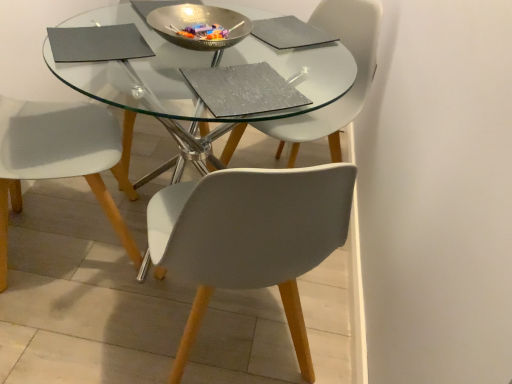
Question: Is metallic silver bowl at center positioned far away from white matte chair at lower left, placed as the first chair when sorted from left to right?

Choices:
 (A) no
 (B) yes

Answer: (A)

Question: Is metallic silver bowl at center to the right of white matte chair at lower left, which is the second chair in right-to-left order, from the viewer's perspective?

Choices:
 (A) no
 (B) yes

Answer: (B)

Question: From a real-world perspective, is metallic silver bowl at center physically below white matte chair at lower left, which is the second chair in right-to-left order?

Choices:
 (A) yes
 (B) no

Answer: (B)

Question: Can you confirm if metallic silver bowl at center is smaller than white matte chair at lower left, which is the second chair in right-to-left order?

Choices:
 (A) no
 (B) yes

Answer: (B)

Question: Is metallic silver bowl at center positioned with its back to white matte chair at lower left, placed as the first chair when sorted from left to right?

Choices:
 (A) no
 (B) yes

Answer: (A)

Question: From the image's perspective, is matte gray chair at center, acting as the second chair starting from the left, above or below white matte chair at lower left, placed as the first chair when sorted from left to right?

Choices:
 (A) above
 (B) below

Answer: (A)

Question: Is matte gray chair at center, the first chair in the right-to-left sequence, in front of or behind white matte chair at lower left, placed as the first chair when sorted from left to right, in the image?

Choices:
 (A) behind
 (B) front

Answer: (A)

Question: Would you say matte gray chair at center, the first chair in the right-to-left sequence, is inside or outside white matte chair at lower left, which is the second chair in right-to-left order?

Choices:
 (A) inside
 (B) outside

Answer: (B)

Question: In terms of height, does matte gray chair at center, acting as the second chair starting from the left, look taller or shorter compared to white matte chair at lower left, placed as the first chair when sorted from left to right?

Choices:
 (A) tall
 (B) short

Answer: (B)

Question: Looking at the image, does metallic silver bowl at center seem bigger or smaller compared to white matte chair at lower left, placed as the first chair when sorted from left to right?

Choices:
 (A) big
 (B) small

Answer: (B)

Question: Is metallic silver bowl at center wider or thinner than white matte chair at lower left, placed as the first chair when sorted from left to right?

Choices:
 (A) thin
 (B) wide

Answer: (A)

Question: Is metallic silver bowl at center inside or outside of white matte chair at lower left, which is the second chair in right-to-left order?

Choices:
 (A) outside
 (B) inside

Answer: (A)

Question: Is point (228, 16) positioned closer to the camera than point (91, 180)?

Choices:
 (A) farther
 (B) closer

Answer: (A)

Question: Considering the positions of matte gray chair at center, the first chair in the right-to-left sequence, and metallic silver bowl at center in the image, is matte gray chair at center, the first chair in the right-to-left sequence, bigger or smaller than metallic silver bowl at center?

Choices:
 (A) big
 (B) small

Answer: (A)

Question: Considering the positions of matte gray chair at center, the first chair in the right-to-left sequence, and metallic silver bowl at center in the image, is matte gray chair at center, the first chair in the right-to-left sequence, wider or thinner than metallic silver bowl at center?

Choices:
 (A) wide
 (B) thin

Answer: (A)